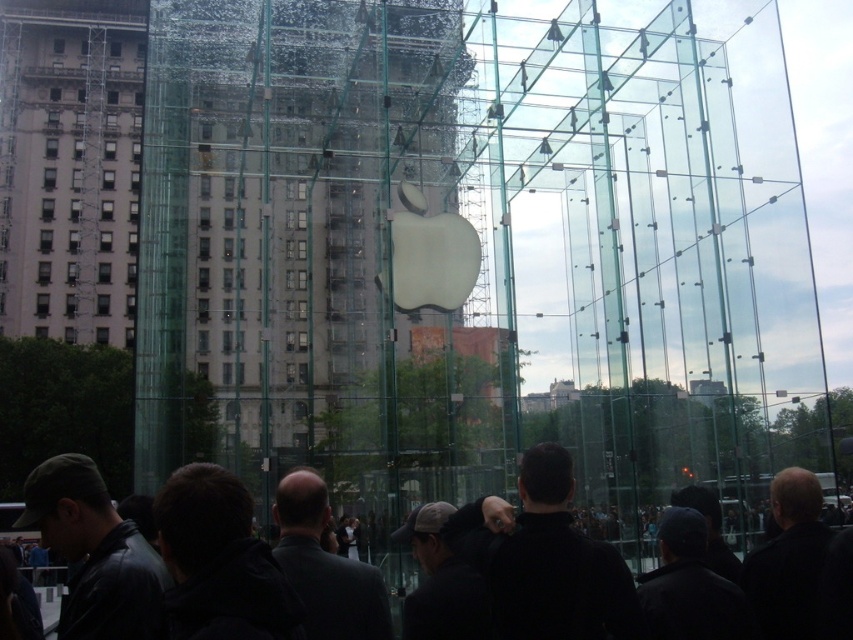
Is point (602, 433) positioned behind point (305, 506)?

That is True.

Consider the image. Can you confirm if transparent glass cube at center is smaller than dark gray jacket at center?

Incorrect, transparent glass cube at center is not smaller in size than dark gray jacket at center.

Is point (672, 410) positioned after point (59, 483)?

Yes, it is.

The width and height of the screenshot is (853, 640). Identify the location of transparent glass cube at center. (480, 243).